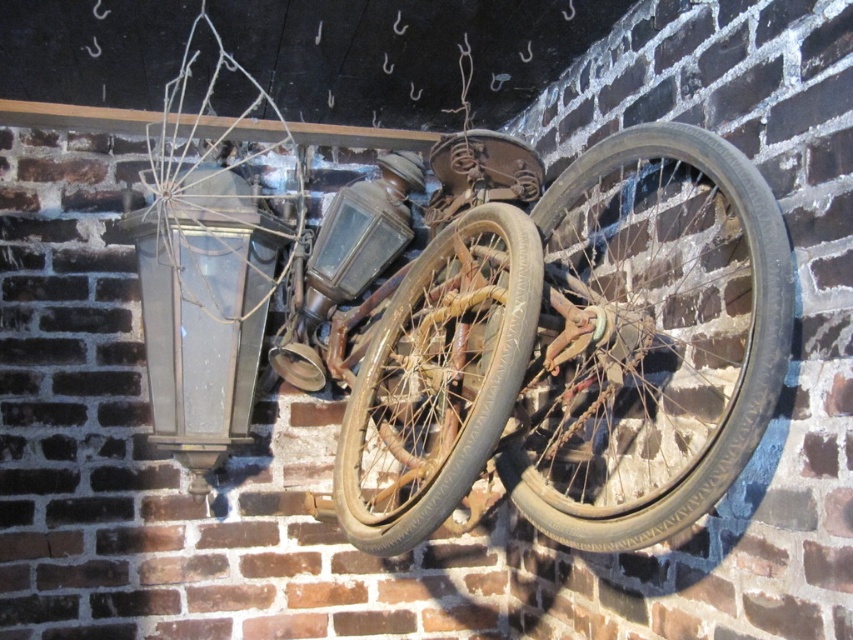
Is rusty metal bicycle wheel at center positioned before rusty metal wheel at center?

Yes, it is in front of rusty metal wheel at center.

Who is more distant from viewer, (x=639, y=371) or (x=416, y=416)?

The point (x=416, y=416) is more distant.

This screenshot has height=640, width=853. Find the location of `rusty metal bicycle wheel at center`. rusty metal bicycle wheel at center is located at coordinates (653, 337).